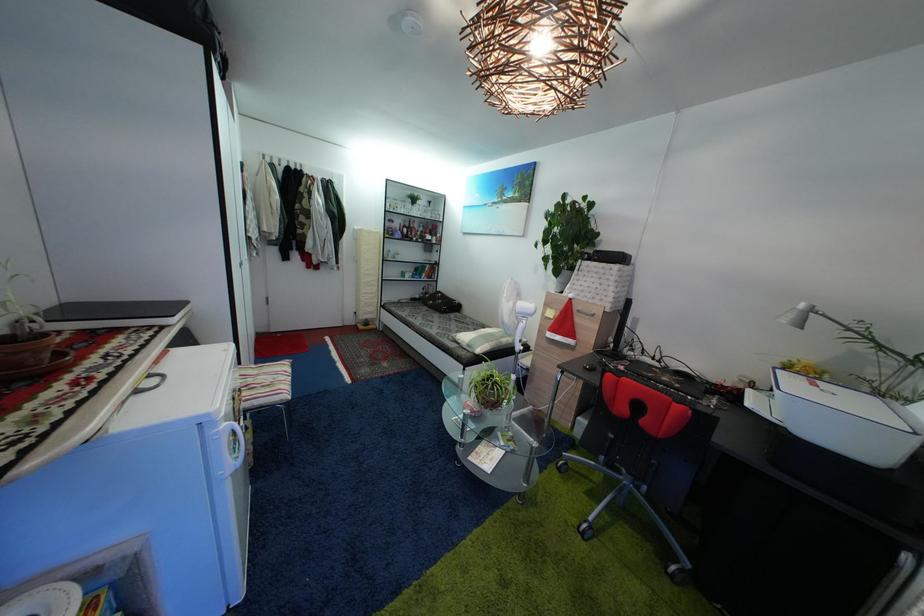
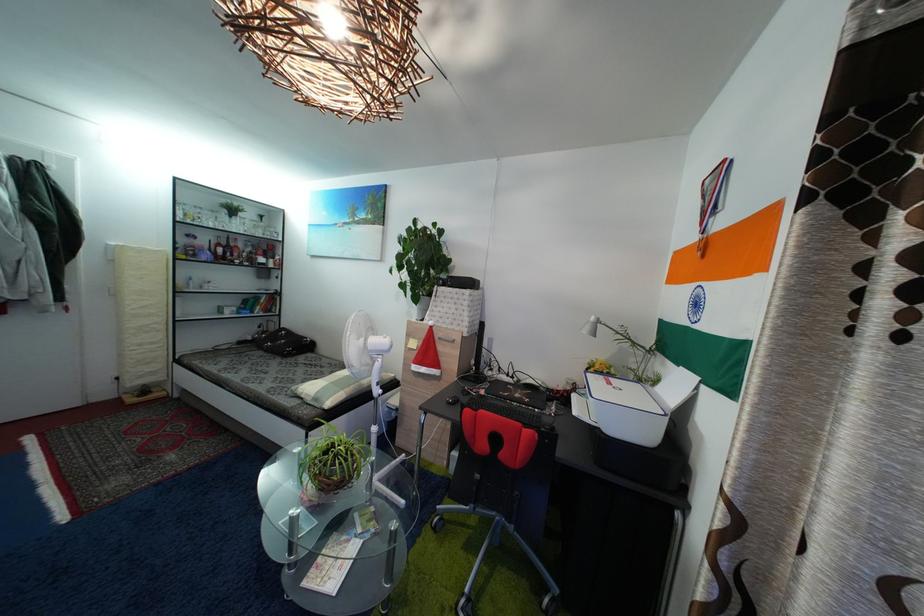
Where in the second image is the point corresponding to [532,313] from the first image?

(386, 349)